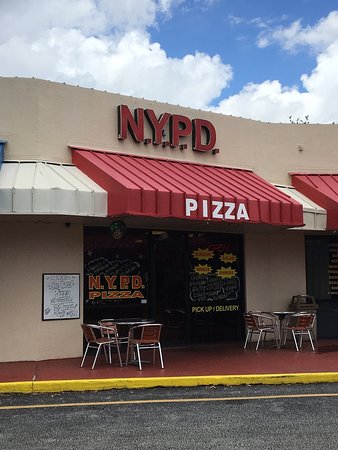
Locate an element on the screen. The image size is (338, 450). front of whiteboard is located at coordinates (48, 299).